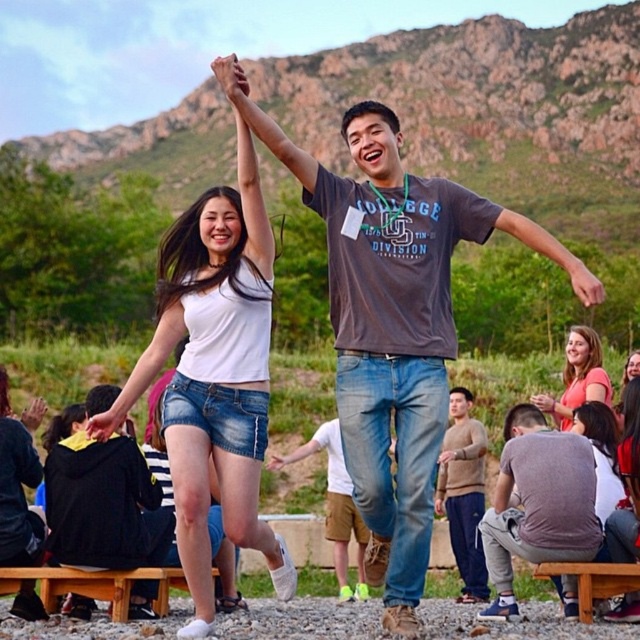
Is matte white hand at upper center taller than matte black hand at upper left?

Yes.

Can you confirm if matte white hand at upper center is wider than matte black hand at upper left?

No, matte white hand at upper center is not wider than matte black hand at upper left.

The height and width of the screenshot is (640, 640). What are the coordinates of `matte white hand at upper center` in the screenshot? It's located at (230, 77).

Where is `matte white hand at upper center`? This screenshot has width=640, height=640. matte white hand at upper center is located at coordinates (230, 77).

Between gray fabric arm at center and smooth yellow cloth at center, which one is positioned lower?

smooth yellow cloth at center

Between gray fabric arm at center and smooth yellow cloth at center, which one has less height?

Standing shorter between the two is smooth yellow cloth at center.

Identify the location of gray fabric arm at center. pos(520,237).

Based on the photo, who is more forward, (320, 433) or (538, 400)?

Positioned in front is point (538, 400).

Does jeans at center appear under smooth skin hand at center?

Indeed, jeans at center is positioned under smooth skin hand at center.

I want to click on jeans at center, so click(339, 508).